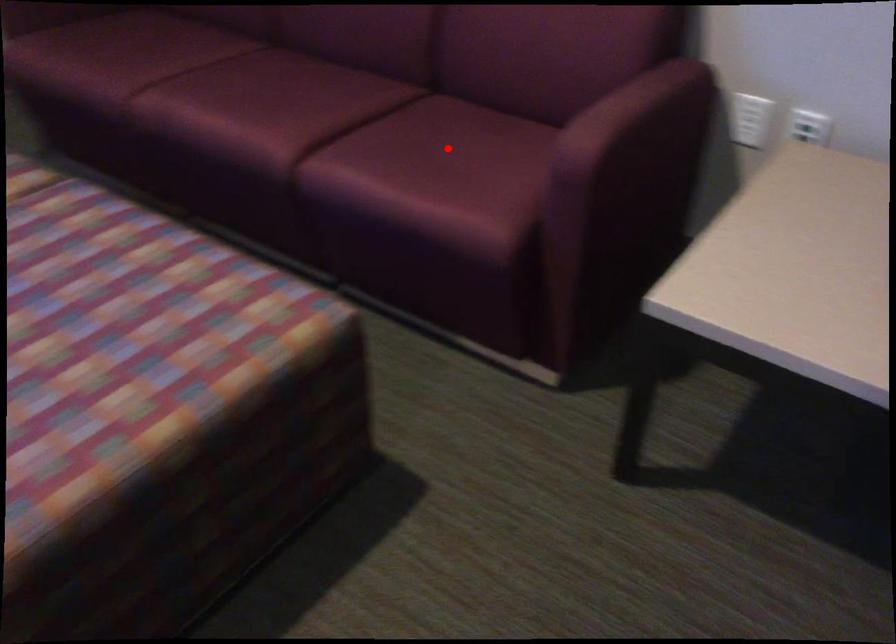
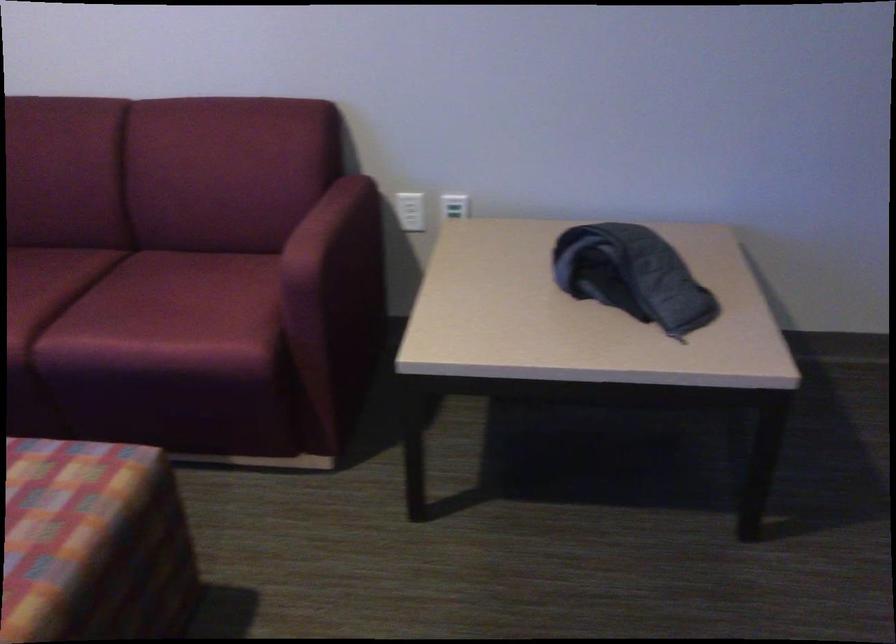
Question: I am providing you with two images of the same scene from different viewpoints. Given a red point in image1, look at the same physical point in image2. Is it:

Choices:
 (A) Closer to the viewpoint
 (B) Farther from the viewpoint

Answer: (B)